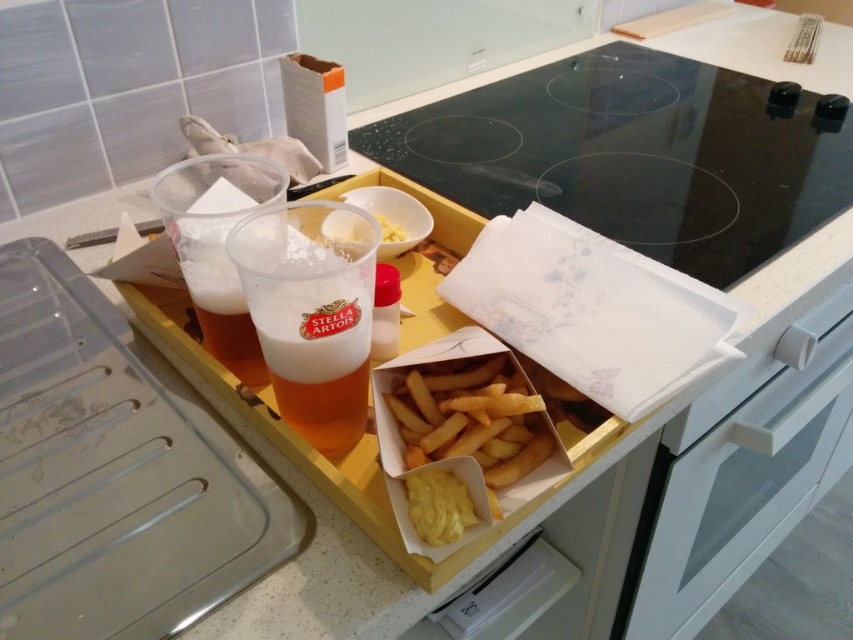
Question: Is golden crispy french fries at center thinner than yellow creamy spread at lower center?

Choices:
 (A) no
 (B) yes

Answer: (A)

Question: Can you confirm if white glossy drawer at lower right is positioned below yellow creamy spread at lower center?

Choices:
 (A) yes
 (B) no

Answer: (A)

Question: Does white glossy drawer at lower right appear on the left side of yellow creamy spread at lower center?

Choices:
 (A) no
 (B) yes

Answer: (A)

Question: Which point is farther to the camera?

Choices:
 (A) (715, 538)
 (B) (410, 416)
 (C) (416, 486)

Answer: (A)

Question: Which point is closer to the camera?

Choices:
 (A) (838, 448)
 (B) (480, 448)
 (C) (450, 508)

Answer: (C)

Question: Which point is closer to the camera?

Choices:
 (A) (440, 540)
 (B) (531, 420)
 (C) (726, 486)

Answer: (A)